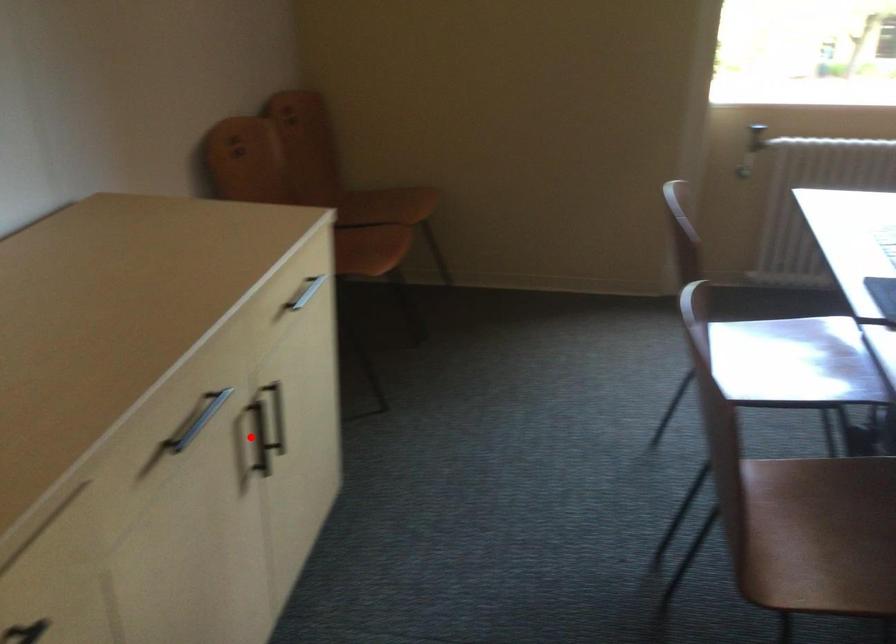
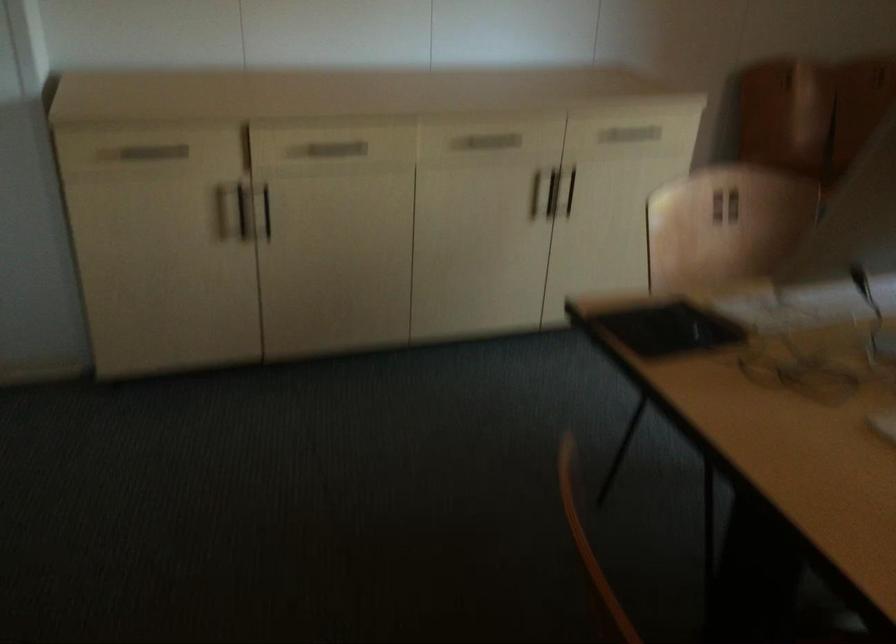
Find the pixel in the second image that matches the highlighted location in the first image.

(552, 192)